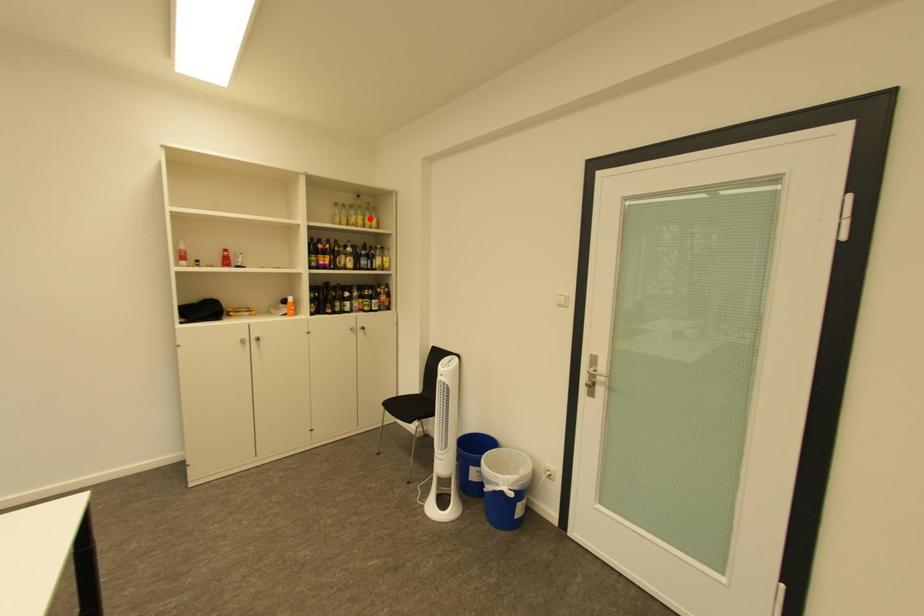
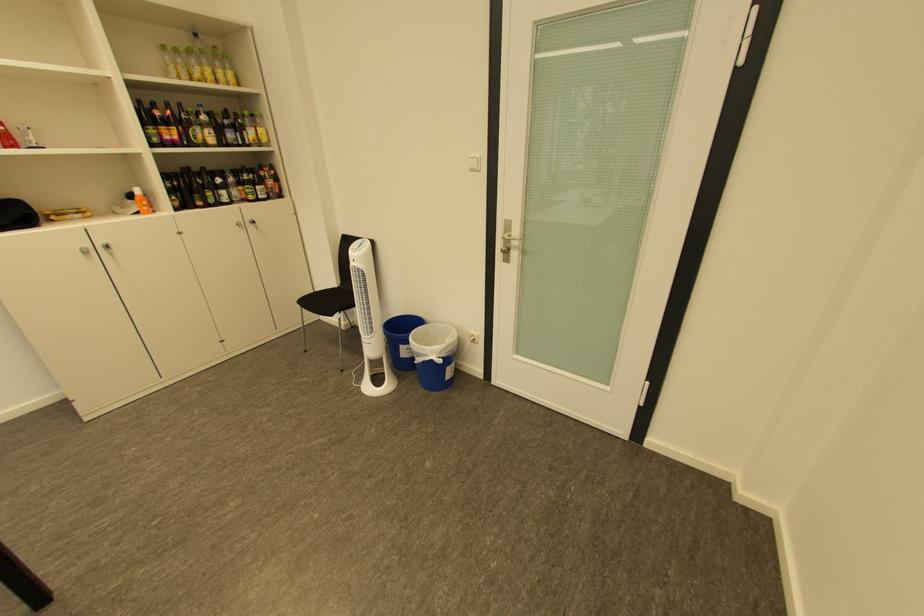
Locate, in the second image, the point that corresponds to the highlighted location in the first image.

(217, 71)